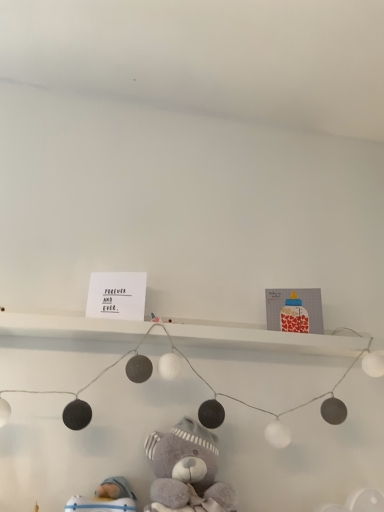
Question: Is point (231, 504) closer or farther from the camera than point (72, 498)?

Choices:
 (A) farther
 (B) closer

Answer: (B)

Question: Choose the correct answer: Is fluffy gray teddy bear at lower center inside blue fabric toy at lower left or outside it?

Choices:
 (A) inside
 (B) outside

Answer: (B)

Question: In terms of size, does fluffy gray teddy bear at lower center appear bigger or smaller than blue fabric toy at lower left?

Choices:
 (A) big
 (B) small

Answer: (A)

Question: Considering the positions of point (97, 494) and point (173, 482), is point (97, 494) closer or farther from the camera than point (173, 482)?

Choices:
 (A) closer
 (B) farther

Answer: (B)

Question: Considering the positions of blue fabric toy at lower left and fluffy gray teddy bear at lower center in the image, is blue fabric toy at lower left taller or shorter than fluffy gray teddy bear at lower center?

Choices:
 (A) short
 (B) tall

Answer: (A)

Question: In the image, is blue fabric toy at lower left on the left side or the right side of fluffy gray teddy bear at lower center?

Choices:
 (A) right
 (B) left

Answer: (B)

Question: Do you think blue fabric toy at lower left is within fluffy gray teddy bear at lower center, or outside of it?

Choices:
 (A) outside
 (B) inside

Answer: (A)